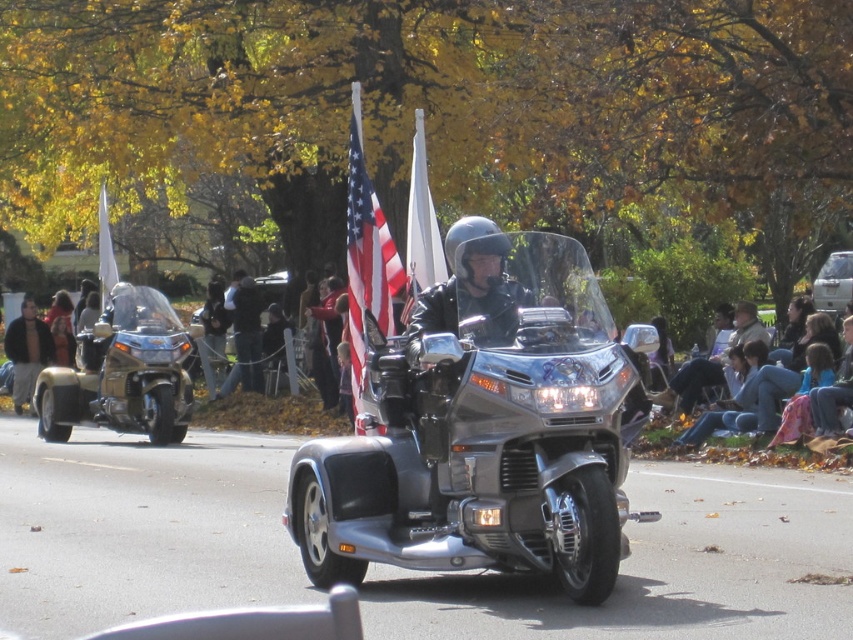
You are standing at the starting line of the parade route and see two points in the image. Which point is closer to you, point (148, 346) or point (103, 289)?

Point (148, 346) is closer to the viewer than point (103, 289).

You are a photographer positioned at the base of a tree in the scene. You want to take a photo that includes both the gold metallic trike at left and the white fabric flag at upper left. Given that your camera has a maximum focus range of 6 feet, will both objects be in focus?

The distance between the gold metallic trike at left and the white fabric flag at upper left is 5.82 feet, which is within the camera maximum focus range of 6 feet. Therefore, both objects will be in focus.